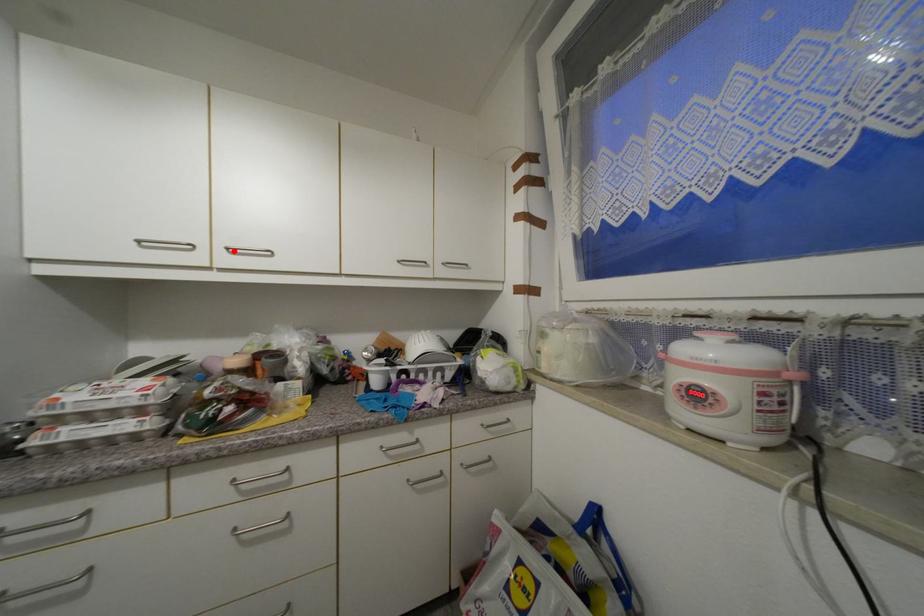
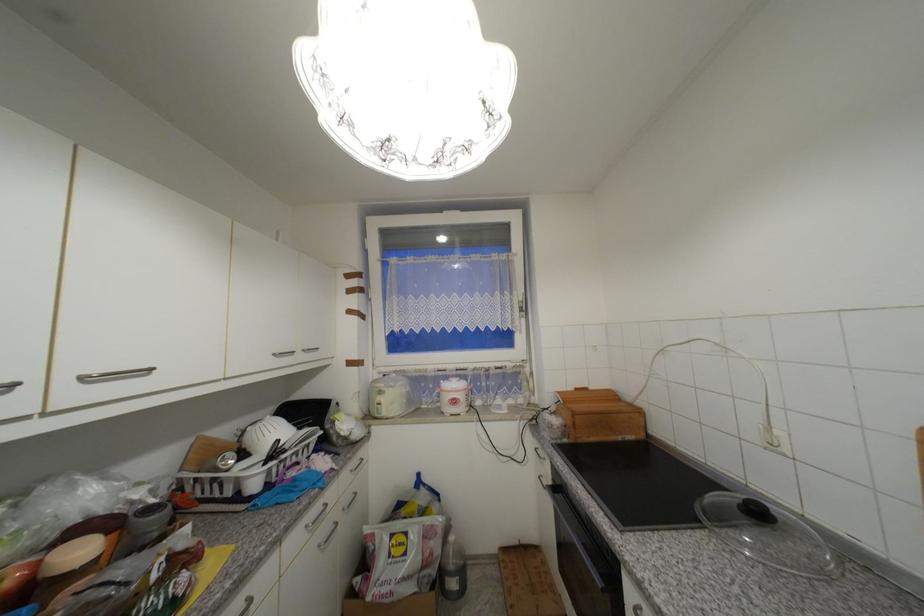
Where in the second image is the point corresponding to the highlighted location from the first image?

(89, 379)